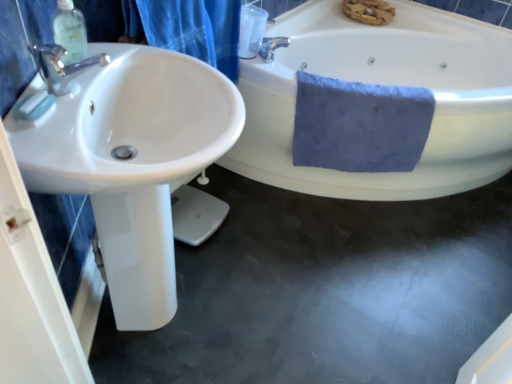
Question: Is white glossy bathtub at upper right turned away from clear plastic soap dispenser at upper left?

Choices:
 (A) yes
 (B) no

Answer: (B)

Question: Does white glossy bathtub at upper right have a lesser width compared to clear plastic soap dispenser at upper left?

Choices:
 (A) no
 (B) yes

Answer: (A)

Question: From a real-world perspective, is white glossy bathtub at upper right under clear plastic soap dispenser at upper left?

Choices:
 (A) no
 (B) yes

Answer: (B)

Question: Is white glossy bathtub at upper right far from clear plastic soap dispenser at upper left?

Choices:
 (A) yes
 (B) no

Answer: (A)

Question: Is white glossy bathtub at upper right placed right next to clear plastic soap dispenser at upper left?

Choices:
 (A) no
 (B) yes

Answer: (A)

Question: Is the position of white glossy bathtub at upper right more distant than that of clear plastic soap dispenser at upper left?

Choices:
 (A) yes
 (B) no

Answer: (A)

Question: Considering the relative sizes of white glossy bathtub at upper right and blue fabric shower curtain at upper left in the image provided, is white glossy bathtub at upper right shorter than blue fabric shower curtain at upper left?

Choices:
 (A) no
 (B) yes

Answer: (A)

Question: Could you tell me if white glossy bathtub at upper right is turned towards blue fabric shower curtain at upper left?

Choices:
 (A) yes
 (B) no

Answer: (B)

Question: Considering the relative positions of white glossy bathtub at upper right and blue fabric shower curtain at upper left in the image provided, is white glossy bathtub at upper right in front of blue fabric shower curtain at upper left?

Choices:
 (A) yes
 (B) no

Answer: (B)

Question: Does white glossy bathtub at upper right have a greater height compared to blue fabric shower curtain at upper left?

Choices:
 (A) yes
 (B) no

Answer: (A)

Question: From a real-world perspective, is white glossy bathtub at upper right under blue fabric shower curtain at upper left?

Choices:
 (A) no
 (B) yes

Answer: (B)

Question: From the image's perspective, is white glossy bathtub at upper right below blue fabric shower curtain at upper left?

Choices:
 (A) yes
 (B) no

Answer: (A)

Question: Is white glossy bathtub at upper right closer to camera compared to white glossy sink at left?

Choices:
 (A) no
 (B) yes

Answer: (A)